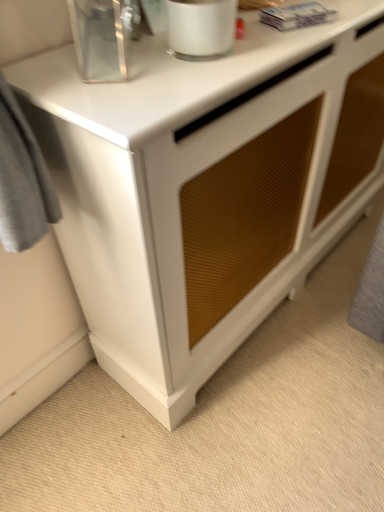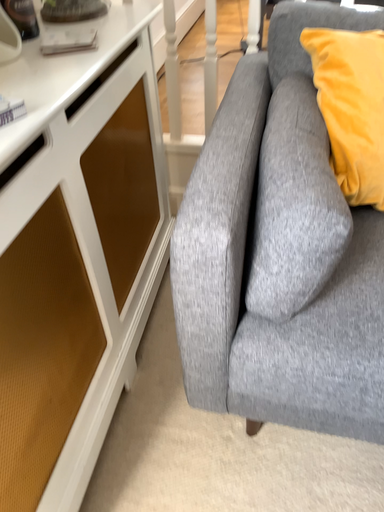
Question: How did the camera likely rotate when shooting the video?

Choices:
 (A) rotated downward
 (B) rotated upward

Answer: (B)